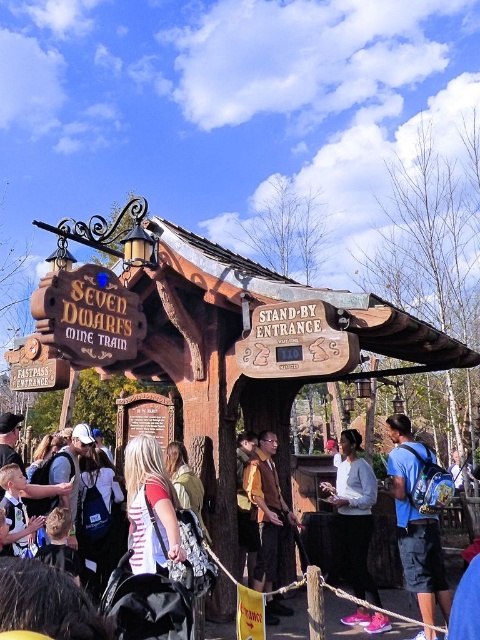
How distant is matte black pants at center from brown suede jacket at center?

The distance of matte black pants at center from brown suede jacket at center is 36.59 inches.

Is point (363, 556) farther from camera compared to point (265, 608)?

Yes.

Where is `matte black pants at center`? matte black pants at center is located at coordinates (354, 513).

Is blue backpack at right above brown suede jacket at center?

Correct, blue backpack at right is located above brown suede jacket at center.

Which is behind, point (418, 600) or point (268, 572)?

Point (268, 572)

Where is `blue backpack at right`? The image size is (480, 640). blue backpack at right is located at coordinates (416, 522).

Who is positioned more to the right, blue backpack at right or wooden signpost at center?

blue backpack at right

Based on the photo, between blue backpack at right and wooden signpost at center, which one is positioned lower?

wooden signpost at center is below.

Is point (422, 609) more distant than point (424, 620)?

No, it is in front of (424, 620).

The image size is (480, 640). I want to click on blue backpack at right, so click(x=416, y=522).